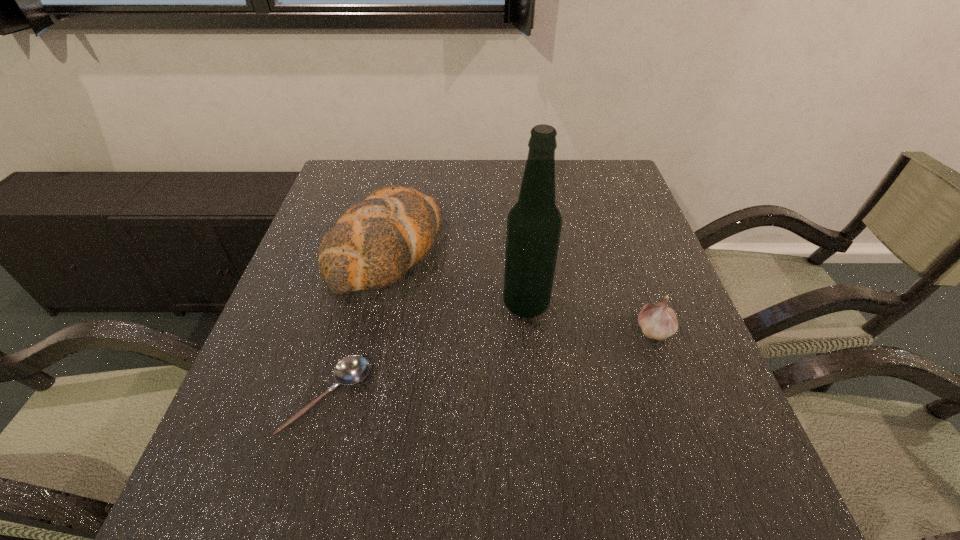
Locate an element on the screen. alcohol is located at coordinates (534, 223).

Where is `the third object from left to right`? This screenshot has height=540, width=960. the third object from left to right is located at coordinates (534, 223).

This screenshot has height=540, width=960. I want to click on the third shortest object, so click(374, 242).

Find the location of a particular element. The image size is (960, 540). the rightmost object is located at coordinates (658, 321).

At what (x,y) coordinates should I click in order to perform the action: click on the second shortest object. Please return your answer as a coordinate pair (x, y). This screenshot has height=540, width=960. Looking at the image, I should click on (658, 321).

At what (x,y) coordinates should I click in order to perform the action: click on the nearest object. Please return your answer as a coordinate pair (x, y). Looking at the image, I should click on (350, 370).

Image resolution: width=960 pixels, height=540 pixels. In order to click on ladle in this screenshot , I will do `click(350, 370)`.

Locate an element on the screen. The height and width of the screenshot is (540, 960). blank space located on the front of the third object from left to right is located at coordinates (532, 364).

Where is `vacant point located 0.390m on the right of the second tallest object`? The image size is (960, 540). vacant point located 0.390m on the right of the second tallest object is located at coordinates (593, 249).

The width and height of the screenshot is (960, 540). I want to click on free space located 0.060m on the front of the third tallest object, so click(x=668, y=370).